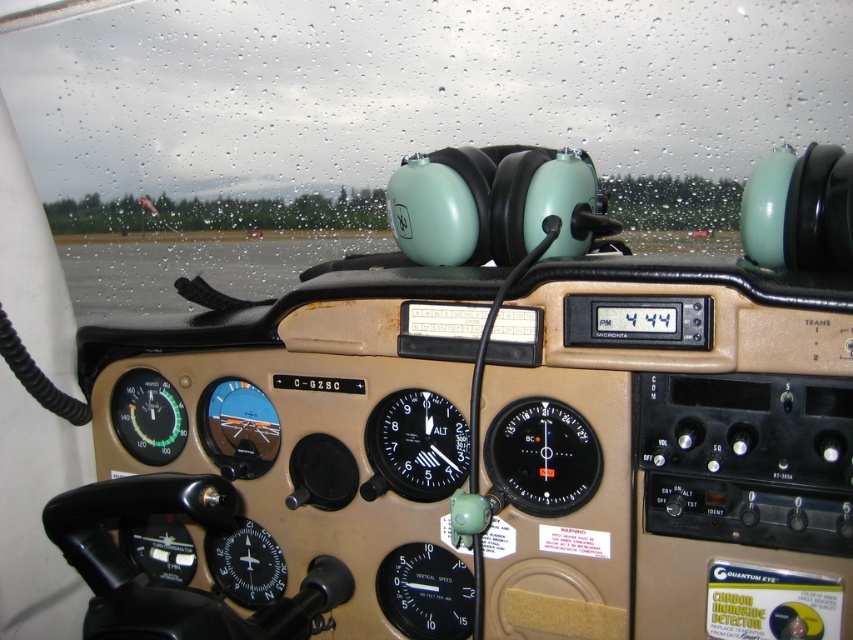
Question: Does transparent glass windshield at upper center appear under black plastic gauge at center?

Choices:
 (A) no
 (B) yes

Answer: (A)

Question: Is transparent glass windshield at upper center smaller than matte black compass at left?

Choices:
 (A) no
 (B) yes

Answer: (A)

Question: Is transparent glass windshield at upper center to the left of black plastic altimeter at center from the viewer's perspective?

Choices:
 (A) no
 (B) yes

Answer: (B)

Question: Which object appears farthest from the camera in this image?

Choices:
 (A) black plastic gauge at center
 (B) matte black compass at left
 (C) black plastic altimeter at center
 (D) transparent glass windshield at upper center

Answer: (D)

Question: Which object appears farthest from the camera in this image?

Choices:
 (A) black plastic gauge at center
 (B) matte black compass at left
 (C) transparent glass windshield at upper center
 (D) black plastic altimeter at center

Answer: (C)

Question: Which object appears closest to the camera in this image?

Choices:
 (A) black plastic gauge at center
 (B) transparent glass windshield at upper center
 (C) matte black compass at left

Answer: (A)